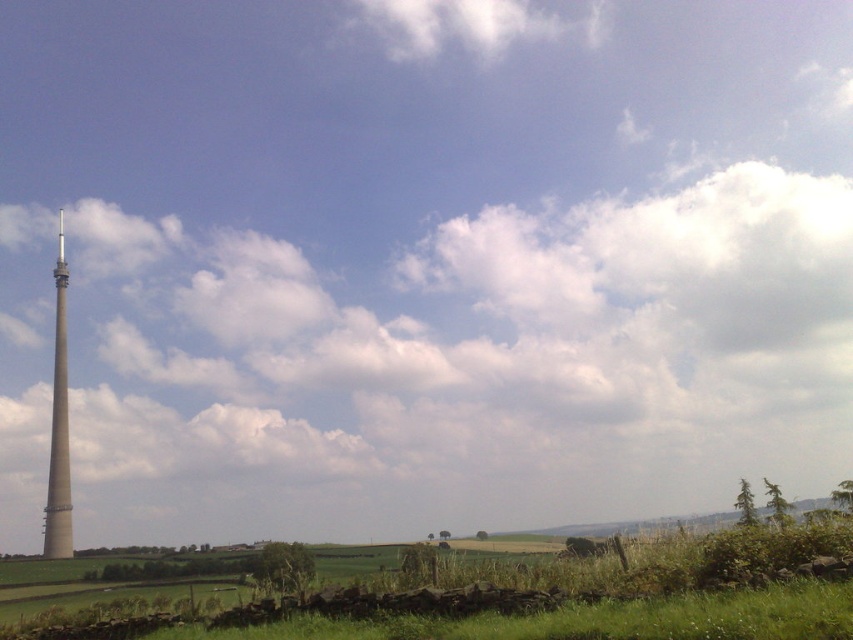
You are standing at the bottom of the image and want to reach the elevated area with dense vegetation. The green grassy field at lower center is in your way. Based on its position, can you estimate where you should step to avoid it?

The green grassy field at lower center is located at coordinates approximately 0.936 on the x axis and 0.624 on the y axis. To avoid it, you should step either to the left or right of this position.

You are a landscape architect planning to install a new garden feature. You have a small statue that needs to be placed in the scene. Which object, the green grassy field at lower center or the smooth white spire at left, would be more suitable for placing the statue based on their sizes?

The green grassy field at lower center has a smaller size compared to the smooth white spire at left. Therefore, the smooth white spire at left would be more suitable for placing the statue as it has a larger area to accommodate the statue without overwhelming it.